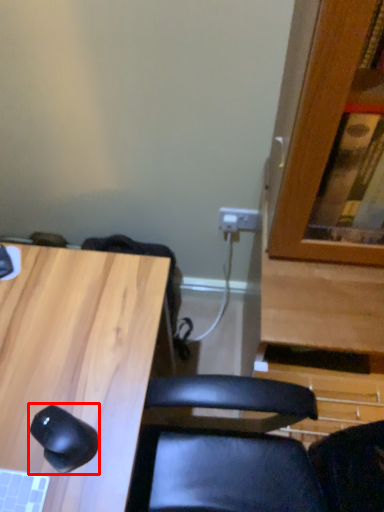
Question: Considering the relative positions of mouse (annotated by the red box) and desk in the image provided, where is mouse (annotated by the red box) located with respect to the staircase?

Choices:
 (A) right
 (B) left

Answer: (A)